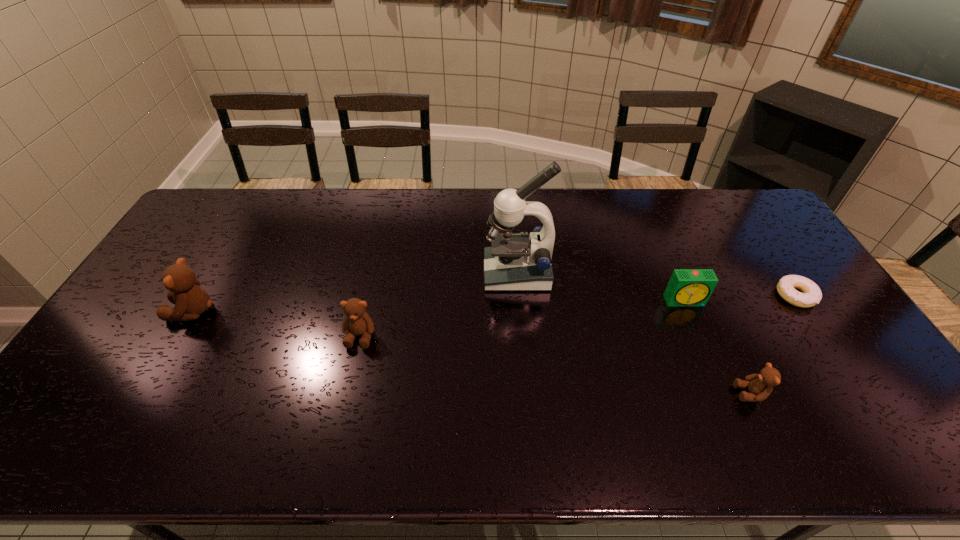
At what (x,y) coordinates should I click in order to perform the action: click on object that is at the right edge. Please return your answer as a coordinate pair (x, y). The width and height of the screenshot is (960, 540). Looking at the image, I should click on (787, 285).

The width and height of the screenshot is (960, 540). Find the location of `vacant space at the far edge`. vacant space at the far edge is located at coordinates (697, 222).

Locate an element on the screen. The width and height of the screenshot is (960, 540). vacant space at the near edge is located at coordinates (227, 401).

In the image, there is a desktop. Identify the location of free region at the left edge. Image resolution: width=960 pixels, height=540 pixels. (207, 267).

The image size is (960, 540). What are the coordinates of `vacant space at the right edge of the desktop` in the screenshot? It's located at (771, 258).

In the image, there is a desktop. At what (x,y) coordinates should I click in order to perform the action: click on vacant space at the far left corner. Please return your answer as a coordinate pair (x, y). The width and height of the screenshot is (960, 540). Looking at the image, I should click on (242, 211).

The width and height of the screenshot is (960, 540). In the image, there is a desktop. In order to click on free space at the near left corner in this screenshot , I will do `click(119, 386)`.

Identify the location of vacant area between the shortest teddy bear and the shortest object. Image resolution: width=960 pixels, height=540 pixels. (773, 345).

The image size is (960, 540). Find the location of `free spot between the third object from left to right and the second tallest object`. free spot between the third object from left to right and the second tallest object is located at coordinates (355, 292).

Locate an element on the screen. free point between the microscope and the alarm clock is located at coordinates (601, 287).